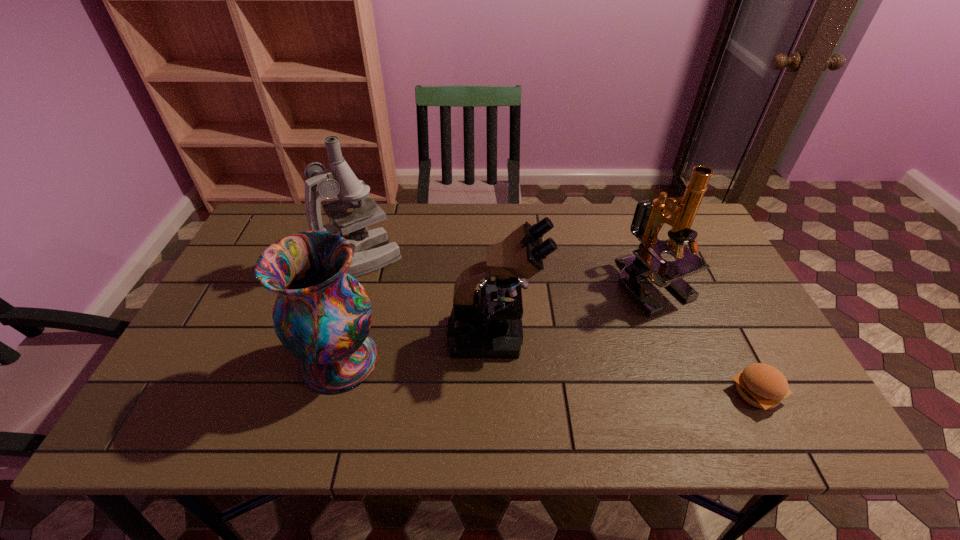
You are a GUI agent. You are given a task and a screenshot of the screen. Output one action in this format:
    pyautogui.click(x=<x>, y=<y>)
    Task: Click on the free space that is in between the rightmost microscope and the hamburger
    The width and height of the screenshot is (960, 540).
    Given the screenshot: What is the action you would take?
    pyautogui.click(x=705, y=339)

Where is `free space between the hamburger and the second microscope from right to left`? This screenshot has height=540, width=960. free space between the hamburger and the second microscope from right to left is located at coordinates (625, 364).

Find the location of `vacant area that lies between the hamburger and the leftmost microscope`. vacant area that lies between the hamburger and the leftmost microscope is located at coordinates (558, 326).

Where is `free area in between the vase and the shortest object`? The image size is (960, 540). free area in between the vase and the shortest object is located at coordinates (548, 377).

Locate an element on the screen. The height and width of the screenshot is (540, 960). vacant area that lies between the rightmost microscope and the hamburger is located at coordinates (705, 339).

The width and height of the screenshot is (960, 540). I want to click on free space between the vase and the third object from right to left, so click(x=418, y=348).

Image resolution: width=960 pixels, height=540 pixels. What are the coordinates of `the third closest object to the rightmost microscope` in the screenshot? It's located at click(371, 250).

Locate which object ranks second in proximity to the shortest object. Please provide its 2D coordinates. Your answer should be formatted as a tuple, i.e. [(x, y)], where the tuple contains the x and y coordinates of a point satisfying the conditions above.

[(479, 327)]

Select which microscope is the second closest to the second microscope from left to right. Please provide its 2D coordinates. Your answer should be formatted as a tuple, i.e. [(x, y)], where the tuple contains the x and y coordinates of a point satisfying the conditions above.

[(649, 217)]

Where is `microscope that is the closest one to the rightmost microscope`? microscope that is the closest one to the rightmost microscope is located at coordinates (479, 327).